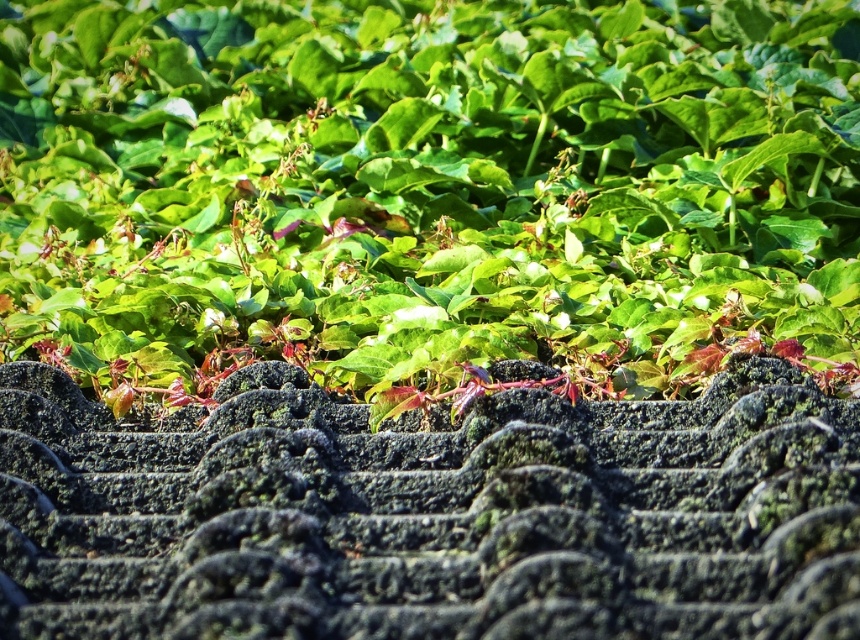
You are a gardener assessing the growth of plants on a roof. You see the green leafy plant at upper center and the green mossy roof tiles at upper center. Which one has a larger spread in width?

The green leafy plant at upper center might be wider than green mossy roof tiles at upper center according to the description.

You are standing at the center of the image and want to place a small decorative stone exactly at the location of the green leafy plant at upper center. What are the coordinates where you should place the stone?

The coordinates for the green leafy plant at upper center are at point (428,189), so you should place the stone there.